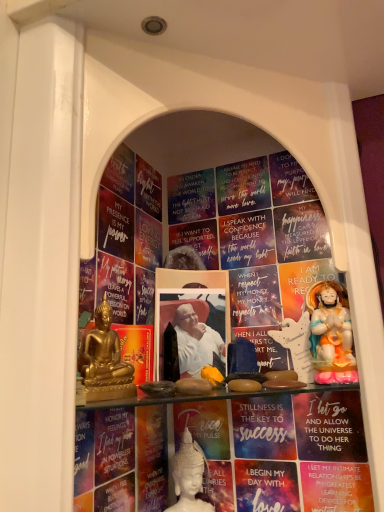
Question: Does matte gold statue at right have a smaller size compared to porcelain statue at right, the 2th person from the front?

Choices:
 (A) yes
 (B) no

Answer: (A)

Question: From a real-world perspective, is matte gold statue at right on top of porcelain statue at right, the third person in the left-to-right sequence?

Choices:
 (A) yes
 (B) no

Answer: (B)

Question: Considering the relative positions of matte gold statue at right and porcelain statue at right, which appears as the 2th person when viewed from the back, in the image provided, is matte gold statue at right in front of porcelain statue at right, which appears as the 2th person when viewed from the back,?

Choices:
 (A) no
 (B) yes

Answer: (A)

Question: Is matte gold statue at right next to porcelain statue at right, the third person in the bottom-to-top sequence, and touching it?

Choices:
 (A) no
 (B) yes

Answer: (B)

Question: Does matte gold statue at right lie behind porcelain statue at right, the third person in the bottom-to-top sequence?

Choices:
 (A) yes
 (B) no

Answer: (A)

Question: Do you think white porcelain statue at center, the 3th person positioned from the front, is within matte blue paperback book at center, the 3th paperback book from the left, or outside of it?

Choices:
 (A) outside
 (B) inside

Answer: (A)

Question: In terms of width, does white porcelain statue at center, placed as the 1th person when sorted from bottom to top, look wider or thinner when compared to matte blue paperback book at center, the first paperback book in the right-to-left sequence?

Choices:
 (A) wide
 (B) thin

Answer: (B)

Question: From a real-world perspective, relative to matte blue paperback book at center, the 3th paperback book from the left, is white porcelain statue at center, placed as the 2th person when sorted from right to left, vertically above or below?

Choices:
 (A) below
 (B) above

Answer: (A)

Question: Does point (193, 456) appear closer or farther from the camera than point (236, 437)?

Choices:
 (A) farther
 (B) closer

Answer: (B)

Question: From the image's perspective, is gold metallic statue at left, which ranks as the first person in left-to-right order, positioned above or below porcelain statue at right, which ranks as the 1th person in right-to-left order?

Choices:
 (A) above
 (B) below

Answer: (B)

Question: From a real-world perspective, is gold metallic statue at left, which is the first person from front to back, physically located above or below porcelain statue at right, the third person in the left-to-right sequence?

Choices:
 (A) below
 (B) above

Answer: (A)

Question: Does point (100, 336) appear closer or farther from the camera than point (324, 329)?

Choices:
 (A) closer
 (B) farther

Answer: (A)

Question: In terms of size, does gold metallic statue at left, which ranks as the third person in right-to-left order, appear bigger or smaller than porcelain statue at right, the first person in the top-to-bottom sequence?

Choices:
 (A) small
 (B) big

Answer: (A)

Question: In the image, is matte gold statue at right on the left side or the right side of gold metallic statue at left, which is the first person from front to back?

Choices:
 (A) left
 (B) right

Answer: (B)

Question: Is matte gold statue at right bigger or smaller than gold metallic statue at left, placed as the 2th person when sorted from top to bottom?

Choices:
 (A) big
 (B) small

Answer: (B)